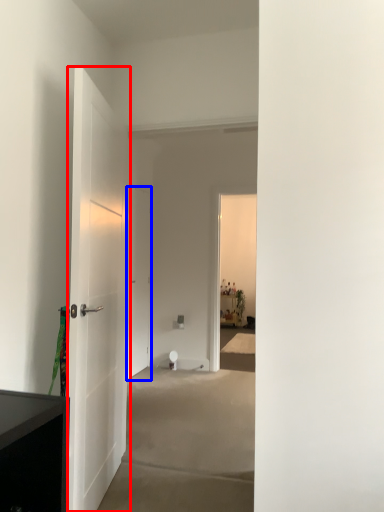
Question: Which object is further to the camera taking this photo, door (highlighted by a red box) or door (highlighted by a blue box)?

Choices:
 (A) door
 (B) door

Answer: (B)